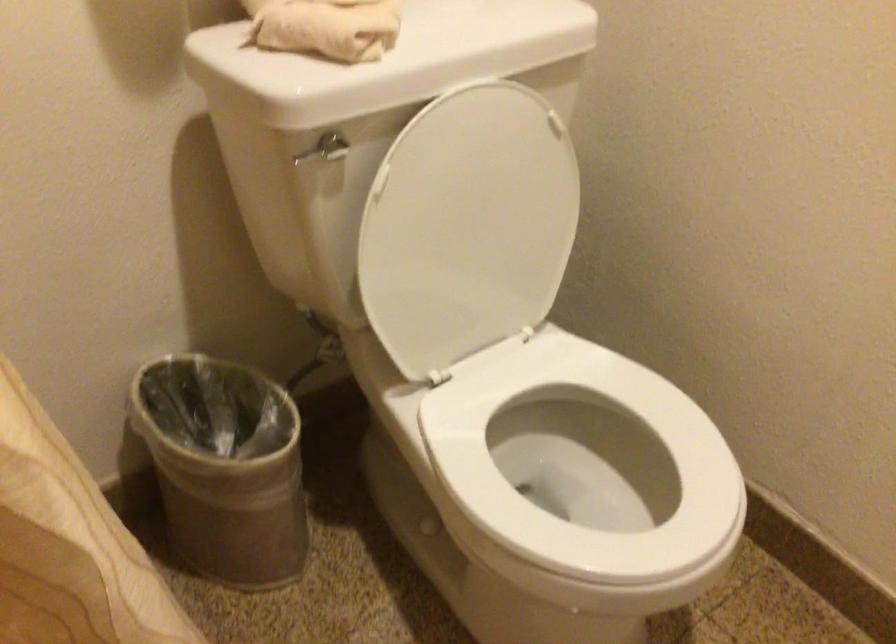
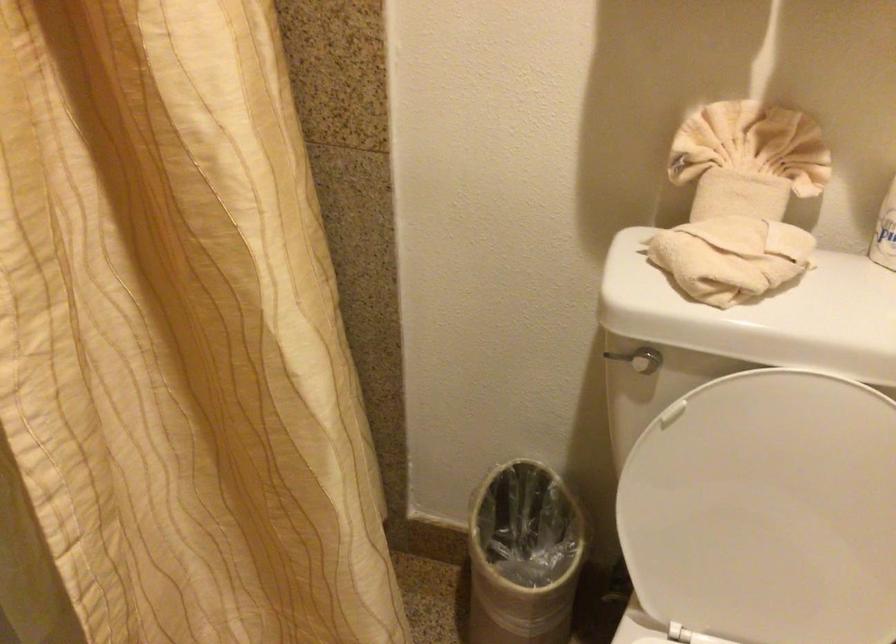
The point at (213,455) is marked in the first image. Where is the corresponding point in the second image?

(522, 556)